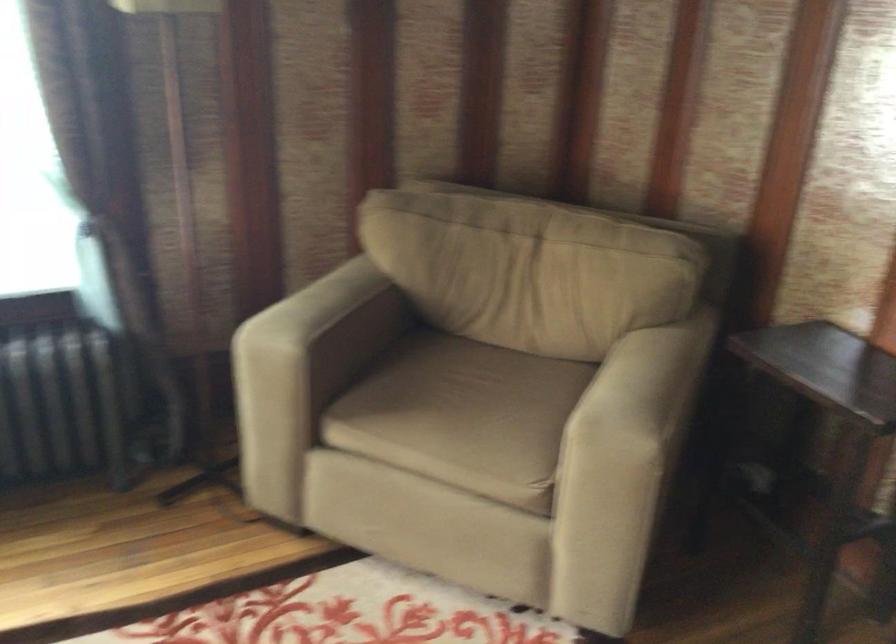
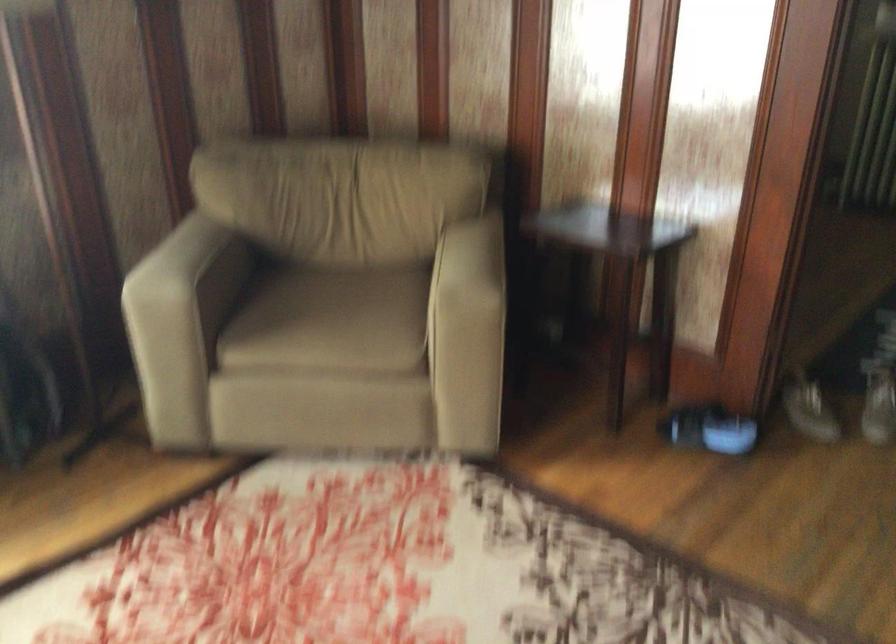
What movement of the cameraman would produce the second image?

The cameraman moved toward left, backward.